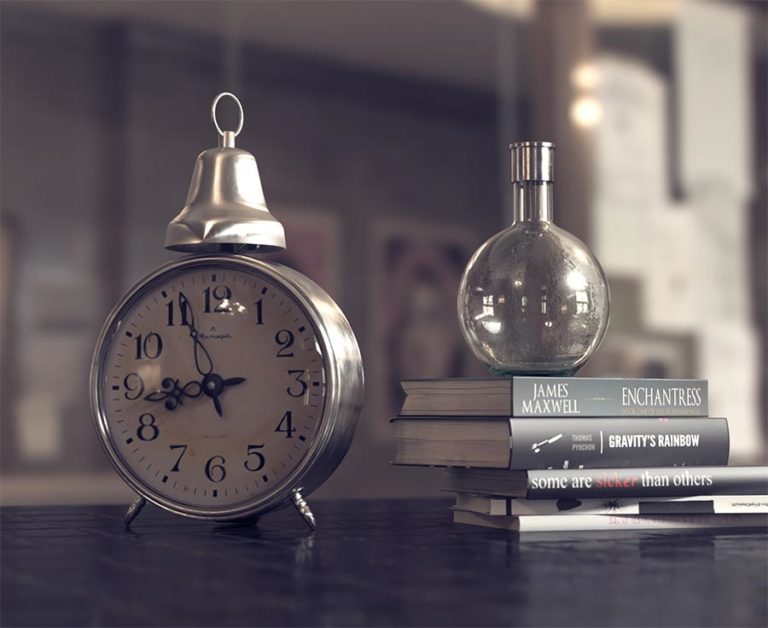
This screenshot has width=768, height=628. In order to click on blurry decor on wall in this screenshot , I will do `click(404, 230)`, `click(309, 219)`.